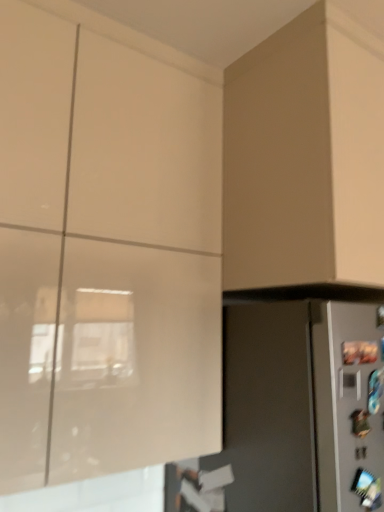
Question: From the image's perspective, is matte gray refrigerator at lower right on matte white cabinet at upper left, arranged as the 1th cabinetry when viewed from the left?

Choices:
 (A) no
 (B) yes

Answer: (A)

Question: Is the position of matte gray refrigerator at lower right less distant than that of matte white cabinet at upper left, arranged as the 1th cabinetry when viewed from the left?

Choices:
 (A) yes
 (B) no

Answer: (B)

Question: Is matte gray refrigerator at lower right not near matte white cabinet at upper left, arranged as the 1th cabinetry when viewed from the left?

Choices:
 (A) yes
 (B) no

Answer: (B)

Question: Can you confirm if matte gray refrigerator at lower right is thinner than matte white cabinet at upper left, arranged as the 1th cabinetry when viewed from the left?

Choices:
 (A) no
 (B) yes

Answer: (A)

Question: Can matte white cabinet at upper left, arranged as the 1th cabinetry when viewed from the left, be found inside matte gray refrigerator at lower right?

Choices:
 (A) no
 (B) yes

Answer: (A)

Question: From the image's perspective, is matte white cabinet at upper left, arranged as the 1th cabinetry when viewed from the left, above or below matte beige cabinet at upper right, arranged as the second cabinetry when viewed from the left?

Choices:
 (A) above
 (B) below

Answer: (B)

Question: From a real-world perspective, relative to matte beige cabinet at upper right, acting as the 1th cabinetry starting from the right, is matte white cabinet at upper left, arranged as the 1th cabinetry when viewed from the left, vertically above or below?

Choices:
 (A) above
 (B) below

Answer: (B)

Question: Considering the positions of matte white cabinet at upper left, arranged as the 1th cabinetry when viewed from the left, and matte beige cabinet at upper right, arranged as the second cabinetry when viewed from the left, in the image, is matte white cabinet at upper left, arranged as the 1th cabinetry when viewed from the left, bigger or smaller than matte beige cabinet at upper right, arranged as the second cabinetry when viewed from the left,?

Choices:
 (A) big
 (B) small

Answer: (A)

Question: Considering the positions of matte white cabinet at upper left, which is counted as the 2th cabinetry, starting from the right, and matte beige cabinet at upper right, arranged as the second cabinetry when viewed from the left, in the image, is matte white cabinet at upper left, which is counted as the 2th cabinetry, starting from the right, wider or thinner than matte beige cabinet at upper right, arranged as the second cabinetry when viewed from the left,?

Choices:
 (A) thin
 (B) wide

Answer: (A)

Question: In terms of width, does matte white cabinet at upper left, arranged as the 1th cabinetry when viewed from the left, look wider or thinner when compared to matte gray refrigerator at lower right?

Choices:
 (A) wide
 (B) thin

Answer: (B)

Question: From the image's perspective, relative to matte gray refrigerator at lower right, is matte white cabinet at upper left, which is counted as the 2th cabinetry, starting from the right, above or below?

Choices:
 (A) below
 (B) above

Answer: (B)

Question: Considering their positions, is matte white cabinet at upper left, arranged as the 1th cabinetry when viewed from the left, located in front of or behind matte gray refrigerator at lower right?

Choices:
 (A) behind
 (B) front

Answer: (B)

Question: Considering the positions of point (81, 70) and point (236, 374), is point (81, 70) closer or farther from the camera than point (236, 374)?

Choices:
 (A) farther
 (B) closer

Answer: (B)

Question: Is matte gray refrigerator at lower right bigger or smaller than matte beige cabinet at upper right, arranged as the second cabinetry when viewed from the left?

Choices:
 (A) small
 (B) big

Answer: (B)

Question: Is point (276, 441) positioned closer to the camera than point (271, 138)?

Choices:
 (A) closer
 (B) farther

Answer: (A)